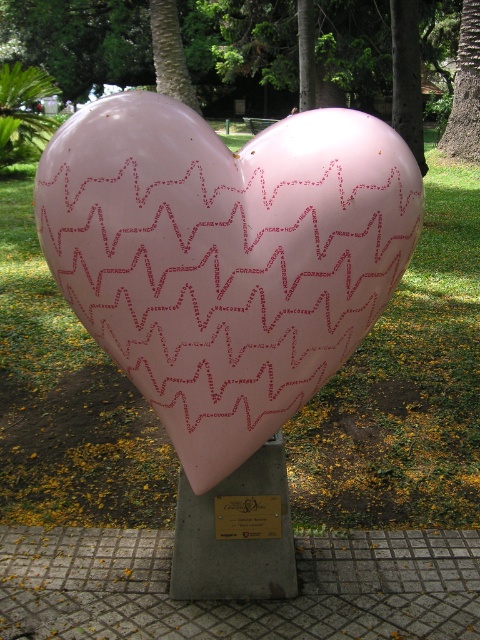
Is the position of green textured palm tree at upper center more distant than that of metallic gold plaque at center?

Yes.

Which is above, green textured palm tree at upper center or metallic gold plaque at center?

Positioned higher is green textured palm tree at upper center.

Does point (187, 83) come farther from viewer compared to point (242, 499)?

That is True.

The height and width of the screenshot is (640, 480). I want to click on green textured palm tree at upper center, so pyautogui.click(x=169, y=52).

Is green leafy tree at center further to the viewer compared to green textured palm tree at upper center?

No, green leafy tree at center is in front of green textured palm tree at upper center.

Image resolution: width=480 pixels, height=640 pixels. What are the coordinates of `green leafy tree at center` in the screenshot? It's located at (81, 40).

Can you confirm if green leafy tree at center is positioned to the left of smooth brown tree trunk at right?

Correct, you'll find green leafy tree at center to the left of smooth brown tree trunk at right.

Consider the image. Is green leafy tree at center thinner than smooth brown tree trunk at right?

In fact, green leafy tree at center might be wider than smooth brown tree trunk at right.

Locate an element on the screen. The image size is (480, 640). green leafy tree at center is located at coordinates (81, 40).